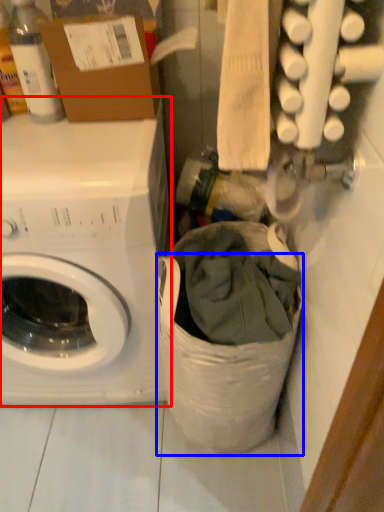
Question: Which of the following is the farthest to the observer, washing machine (highlighted by a red box) or laundry basket (highlighted by a blue box)?

Choices:
 (A) washing machine
 (B) laundry basket

Answer: (A)